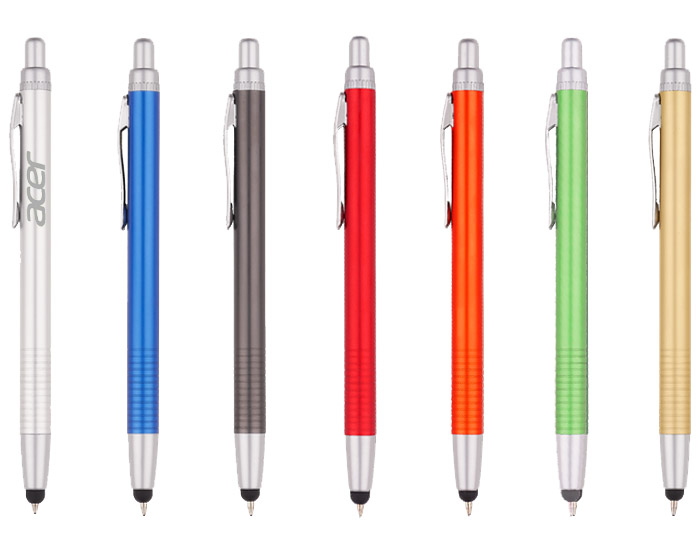
The height and width of the screenshot is (560, 700). What are the coordinates of `pens` in the screenshot? It's located at (29, 375), (140, 386), (242, 384), (364, 380), (468, 380), (578, 380), (678, 386).